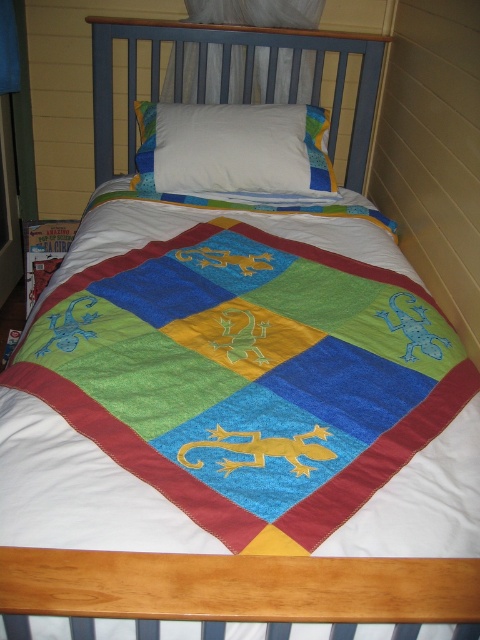
You are a child trying to find your favorite stuffed animal. You see the blue painted wood headboard at upper center and the white soft pillow at center. Which object is closer to the left side of the bed?

The blue painted wood headboard at upper center is closer to the left side of the bed because it is positioned to the left of the white soft pillow at center.

You are a child trying to reach the top of the blue painted wood headboard at upper center and the white soft pillow at center. Which object is taller?

The blue painted wood headboard at upper center is much taller than the white soft pillow at center.